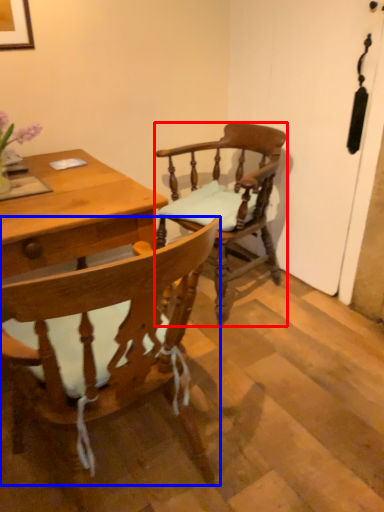
Question: Which object appears closest to the camera in this image, chair (highlighted by a red box) or chair (highlighted by a blue box)?

Choices:
 (A) chair
 (B) chair

Answer: (B)